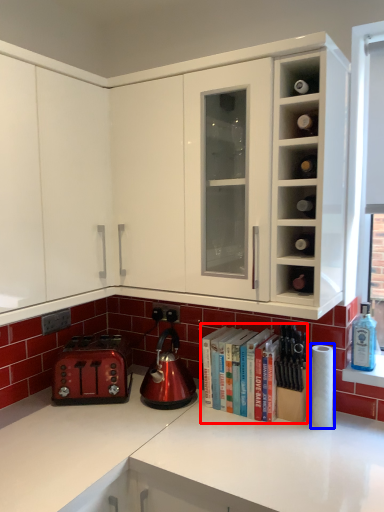
Question: Among these objects, which one is nearest to the camera, book (highlighted by a red box) or paper towel (highlighted by a blue box)?

Choices:
 (A) book
 (B) paper towel

Answer: (B)